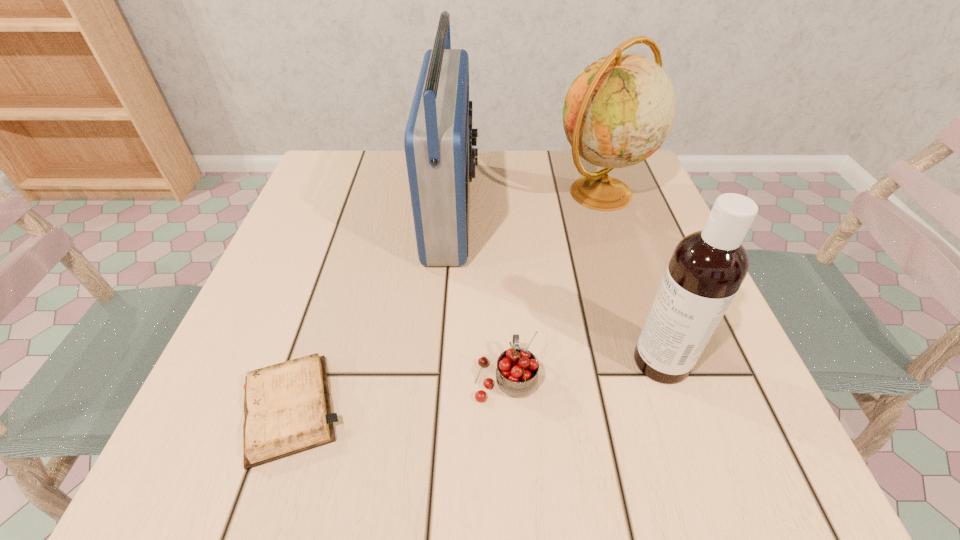
At what (x,y) coordinates should I click in order to perform the action: click on radio receiver. Please return your answer as a coordinate pair (x, y). The width and height of the screenshot is (960, 540). Looking at the image, I should click on (438, 140).

I want to click on globe, so click(x=620, y=109).

Find the location of a particular element. dishwasher detergent is located at coordinates (707, 267).

This screenshot has height=540, width=960. Identify the location of the fourth tallest object. (517, 369).

Identify the location of the shortest object. Image resolution: width=960 pixels, height=540 pixels. (287, 409).

You are a GUI agent. You are given a task and a screenshot of the screen. Output one action in this format:
    pyautogui.click(x=<x>, y=<y>)
    Task: Click on the leftmost object
    The image size is (960, 540).
    Given the screenshot: What is the action you would take?
    pyautogui.click(x=287, y=409)

The height and width of the screenshot is (540, 960). In order to click on vacant region located on the front panel of the radio receiver in this screenshot , I will do `click(599, 209)`.

Locate an element on the screen. The image size is (960, 540). vacant space situated on the front of the globe is located at coordinates (656, 362).

In order to click on free space located 0.120m on the label side of the dishwasher detergent in this screenshot , I will do `click(555, 361)`.

Where is `free space located 0.330m on the label side of the dishwasher detergent`? Image resolution: width=960 pixels, height=540 pixels. free space located 0.330m on the label side of the dishwasher detergent is located at coordinates (417, 361).